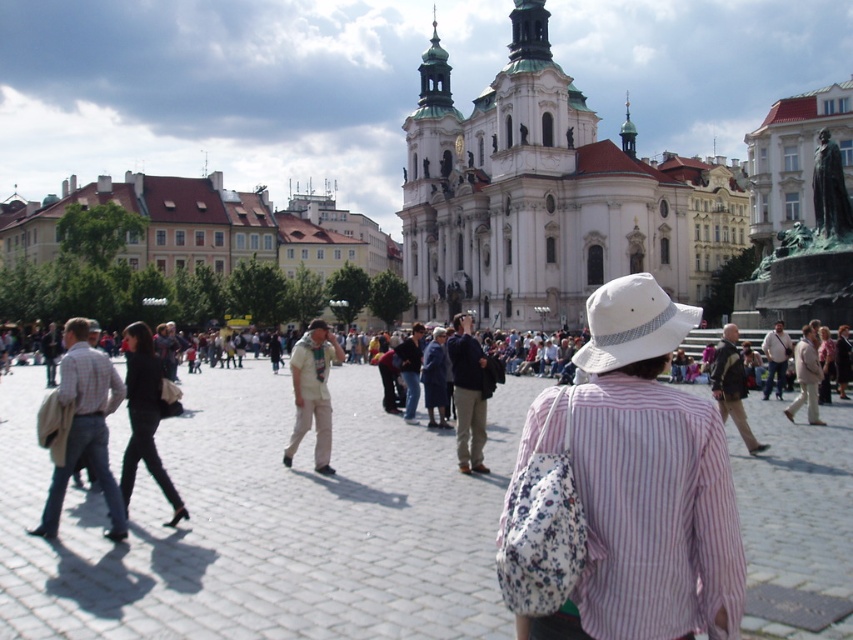
Question: Which point appears closest to the camera in this image?

Choices:
 (A) (677, 179)
 (B) (554, 396)
 (C) (418, 392)

Answer: (B)

Question: Where is white cotton hat at center located in relation to light brown leather jacket at left in the image?

Choices:
 (A) left
 (B) right

Answer: (B)

Question: Among these points, which one is farthest from the camera?

Choices:
 (A) (456, 365)
 (B) (802, 381)
 (C) (99, 358)

Answer: (B)

Question: Can you confirm if light brown leather jacket at left is positioned above dark blue jeans at center?

Choices:
 (A) yes
 (B) no

Answer: (B)

Question: Which point is closer to the camera?

Choices:
 (A) (469, 467)
 (B) (648, 620)
 (C) (581, 138)
 (D) (808, 365)

Answer: (B)

Question: Is white marble church at center to the left of denim jacket at center from the viewer's perspective?

Choices:
 (A) no
 (B) yes

Answer: (A)